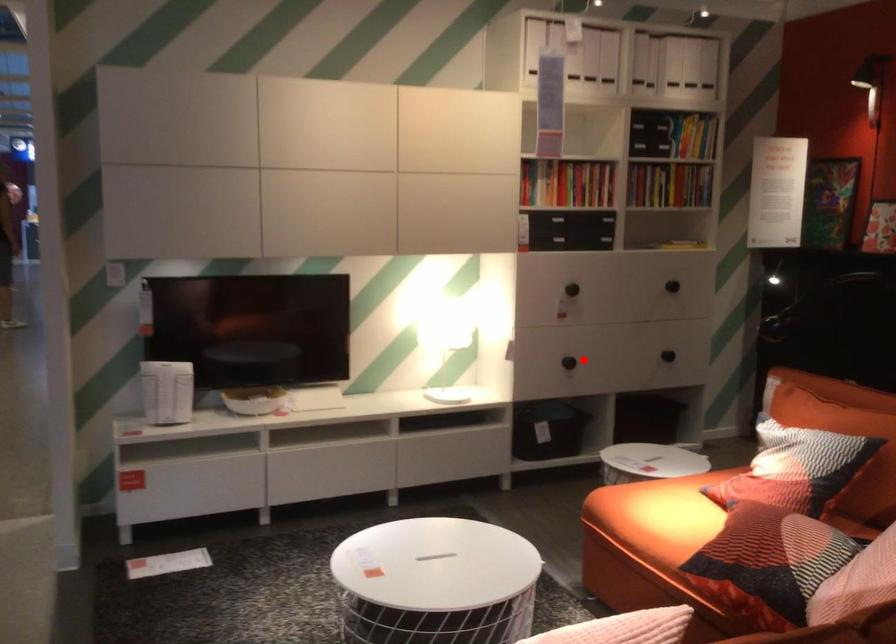
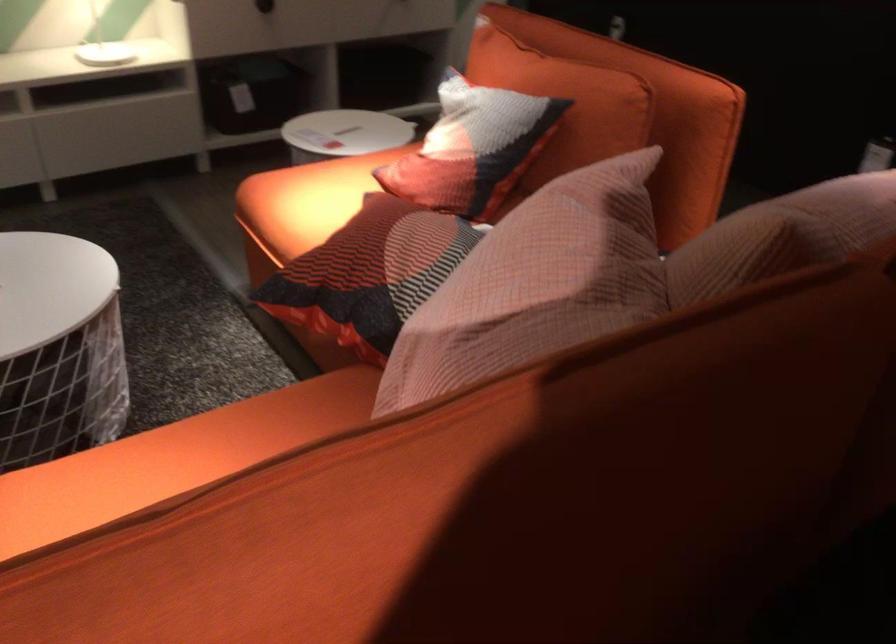
In the second image, find the point that corresponds to the highlighted location in the first image.

(264, 6)